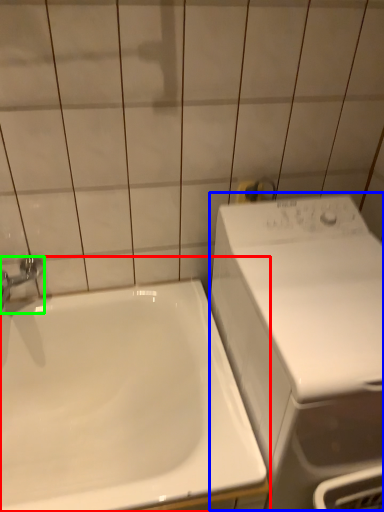
Question: Based on their relative distances, which object is farther from sink (highlighted by a red box)? Choose from washing machine (highlighted by a blue box) and tap (highlighted by a green box).

Choices:
 (A) washing machine
 (B) tap

Answer: (B)